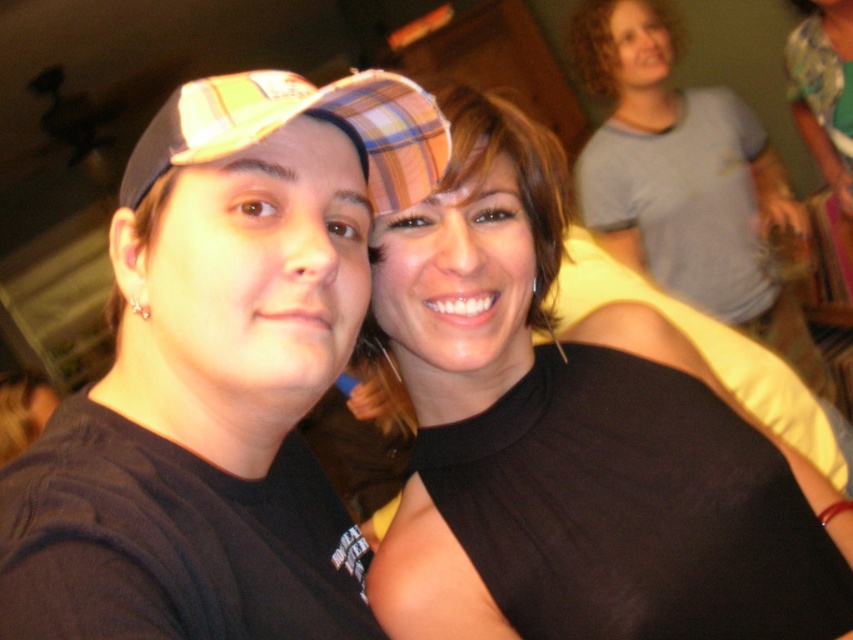
You are trying to locate the black matte tank top at upper right in the photo. According to the coordinates provided, where would you look to find it?

The black matte tank top at upper right is located at coordinates point [573,440].

You are trying to decide which item to place in a display case that can only accommodate one of them. Based on their sizes, which item from the image would you choose, the black matte tank top at upper right or the plaid fabric baseball cap at left?

The black matte tank top at upper right has a larger size compared to the plaid fabric baseball cap at left, so you should choose the black matte tank top at upper right for the display case since it is bigger and will fit better.

You are trying to decide which cap to wear for a casual outing. Both the matte black cap at left and the plaid fabric baseball cap at left are options. Based on the image, which one has a wider brim?

The matte black cap at left has a wider brim than the plaid fabric baseball cap at left according to the description.